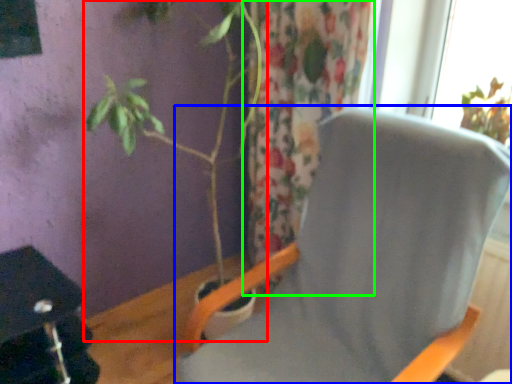
Question: Which object is positioned farthest from houseplant (highlighted by a red box)? Select from chair (highlighted by a blue box) and curtain (highlighted by a green box).

Choices:
 (A) chair
 (B) curtain

Answer: (A)